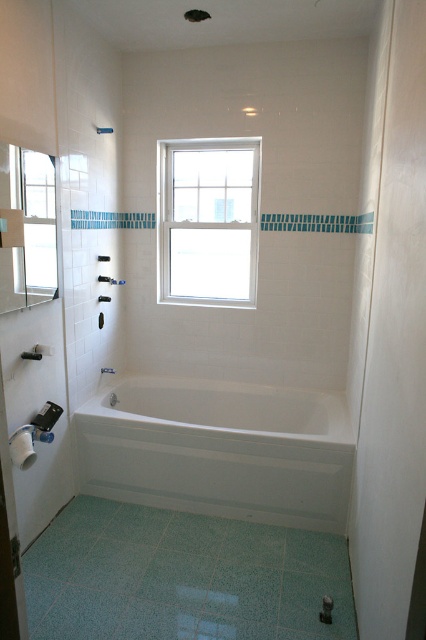
Question: Is white glossy bathtub at center bigger than white glass window at upper center?

Choices:
 (A) yes
 (B) no

Answer: (A)

Question: Is white glossy bathtub at center smaller than white glass window at upper center?

Choices:
 (A) yes
 (B) no

Answer: (B)

Question: Does white glossy bathtub at center have a lesser width compared to white glass window at upper center?

Choices:
 (A) yes
 (B) no

Answer: (B)

Question: Among these objects, which one is farthest from the camera?

Choices:
 (A) white glossy bathtub at center
 (B) white glass window at upper center

Answer: (B)

Question: Which of the following is the farthest from the observer?

Choices:
 (A) (173, 224)
 (B) (233, 461)

Answer: (A)